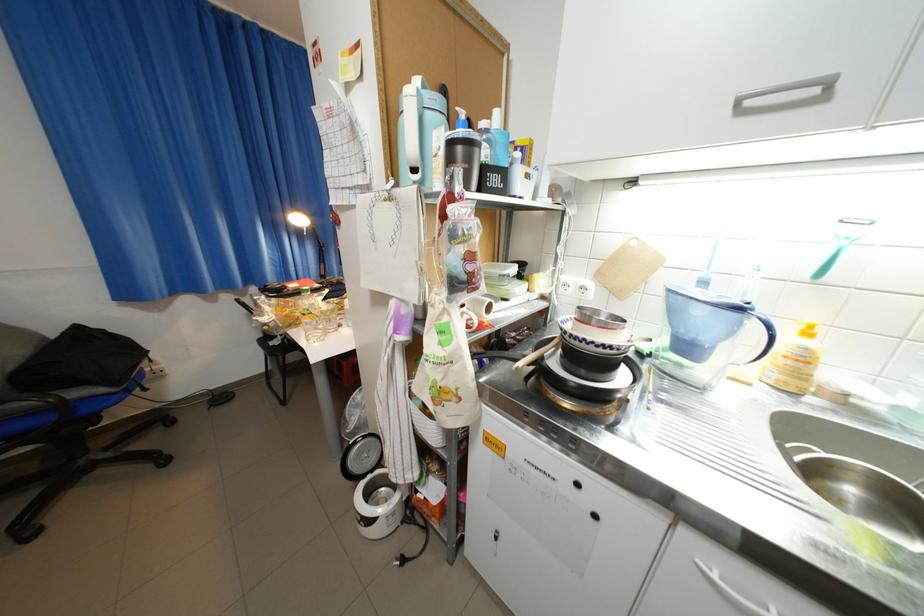
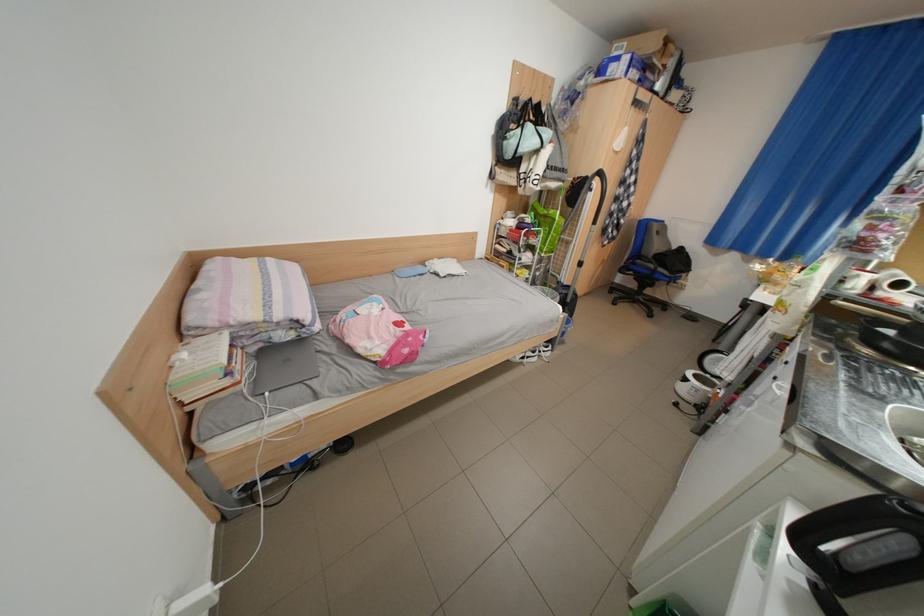
Where in the second image is the point corresponding to point (106, 358) from the first image?

(687, 264)